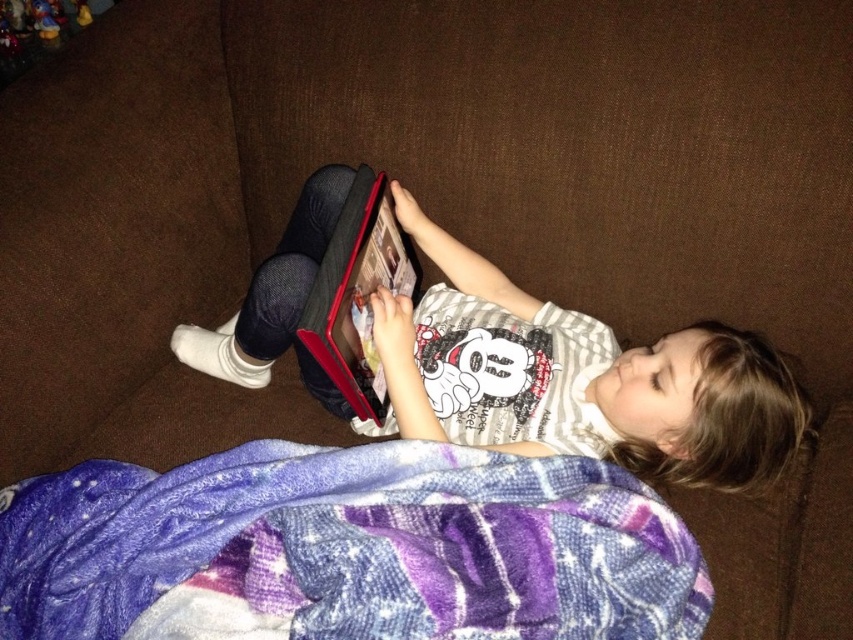
Question: Can you confirm if matte black tablet at center is thinner than plush yellow duck at upper left?

Choices:
 (A) yes
 (B) no

Answer: (B)

Question: Which of the following is the farthest from the observer?

Choices:
 (A) purple fleece blanket at lower center
 (B) plush yellow duck at upper left

Answer: (B)

Question: Which object is closer to the camera taking this photo?

Choices:
 (A) purple fleece blanket at lower center
 (B) matte black tablet at center

Answer: (A)

Question: Does purple fleece blanket at lower center have a greater width compared to plush yellow duck at upper left?

Choices:
 (A) yes
 (B) no

Answer: (A)

Question: Does matte black tablet at center have a lesser width compared to plush yellow duck at upper left?

Choices:
 (A) no
 (B) yes

Answer: (A)

Question: Which point is farther from the camera taking this photo?

Choices:
 (A) (271, 282)
 (B) (38, 8)

Answer: (B)